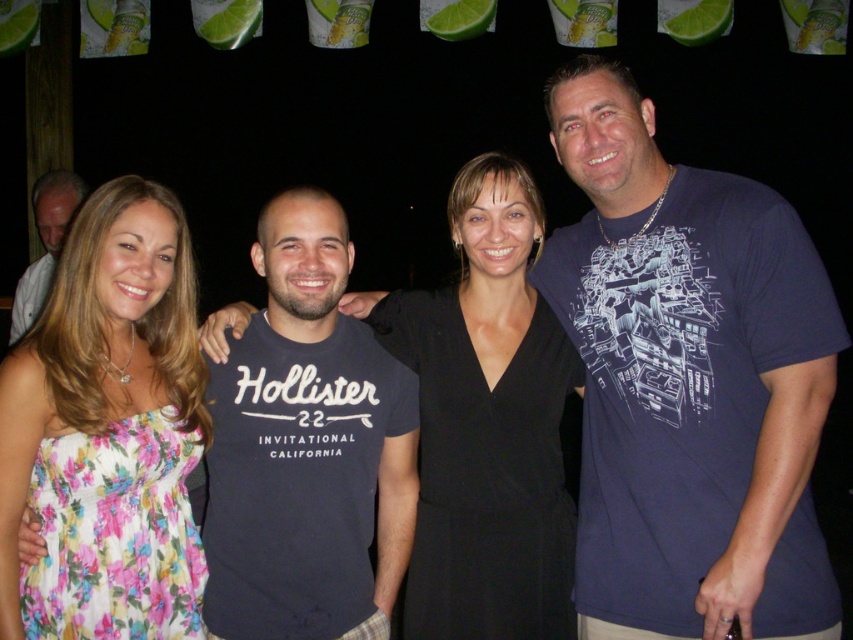
Question: Which of the following is the farthest from the observer?

Choices:
 (A) black matte dress at center
 (B) floral fabric dress at left
 (C) matte black t-shirt at center
 (D) dark blue printed t-shirt at center

Answer: (A)

Question: Can you confirm if black matte dress at center is positioned below floral fabric dress at left?

Choices:
 (A) yes
 (B) no

Answer: (A)

Question: Considering the real-world distances, which object is closest to the white shirt at left?

Choices:
 (A) black matte dress at center
 (B) matte black t-shirt at center
 (C) floral fabric dress at left
 (D) dark blue printed t-shirt at center

Answer: (C)

Question: Is matte black t-shirt at center thinner than black matte dress at center?

Choices:
 (A) no
 (B) yes

Answer: (B)

Question: Which point is farther from the camera taking this photo?

Choices:
 (A) (287, 499)
 (B) (515, 480)

Answer: (B)

Question: Does dark blue printed t-shirt at center lie in front of floral fabric dress at left?

Choices:
 (A) yes
 (B) no

Answer: (A)